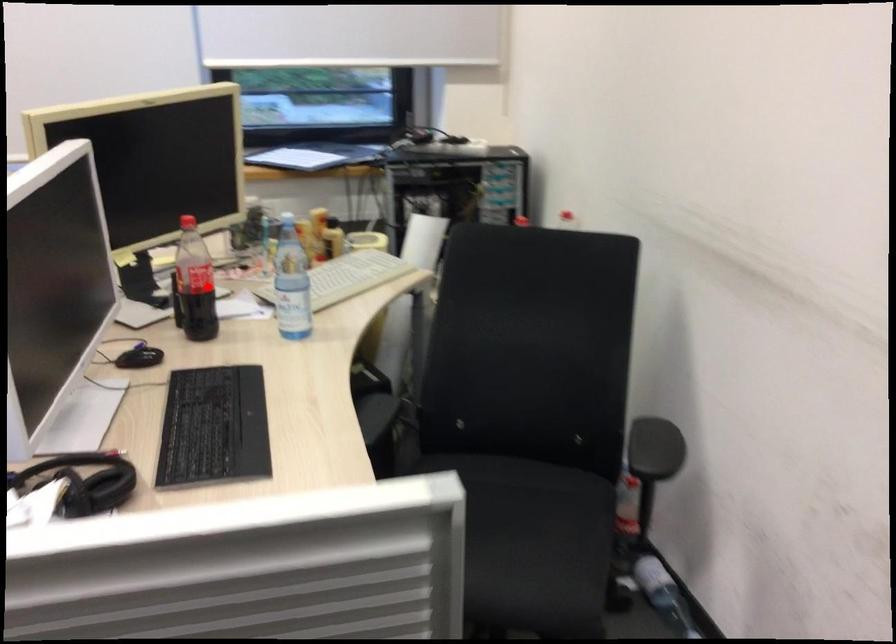
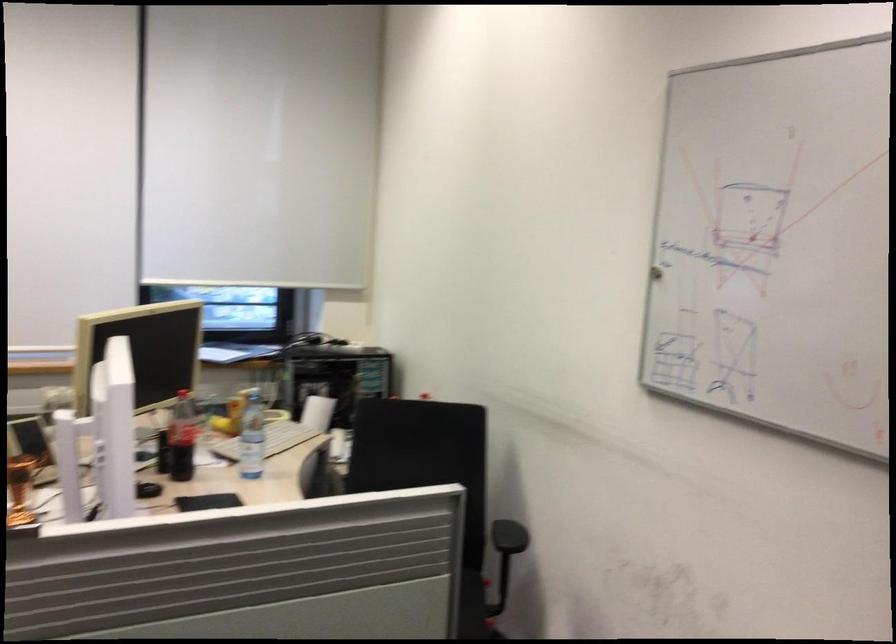
Question: I am providing you with two images of the same scene from different viewpoints. Image1 has a red point marked. In image2, the corresponding 3D location appears at what relative position? Reply with the corresponding letter.

Choices:
 (A) Closer
 (B) Farther

Answer: (B)